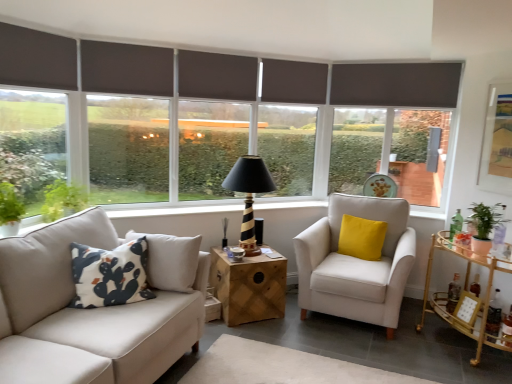
Question: Is dark gray roller blind at left, which is the 4th window from right to left, further to the viewer compared to dark gray roller blind at center, arranged as the second window when viewed from the right?

Choices:
 (A) yes
 (B) no

Answer: (B)

Question: Considering the relative positions of dark gray roller blind at left, which is the 4th window from right to left, and dark gray roller blind at center, arranged as the second window when viewed from the right, in the image provided, is dark gray roller blind at left, which is the 4th window from right to left, to the right of dark gray roller blind at center, arranged as the second window when viewed from the right, from the viewer's perspective?

Choices:
 (A) yes
 (B) no

Answer: (B)

Question: Is dark gray roller blind at center, arranged as the second window when viewed from the right, surrounded by dark gray roller blind at left, the first window positioned from the left?

Choices:
 (A) yes
 (B) no

Answer: (B)

Question: From a real-world perspective, is dark gray roller blind at left, the first window positioned from the left, over dark gray roller blind at center, arranged as the second window when viewed from the right?

Choices:
 (A) no
 (B) yes

Answer: (B)

Question: Considering the relative positions of dark gray roller blind at left, the first window positioned from the left, and dark gray roller blind at center, arranged as the second window when viewed from the right, in the image provided, is dark gray roller blind at left, the first window positioned from the left, to the left of dark gray roller blind at center, arranged as the second window when viewed from the right, from the viewer's perspective?

Choices:
 (A) yes
 (B) no

Answer: (A)

Question: From the image's perspective, is wooden cube at center, marked as the 2th table in a right-to-left arrangement, above or below dark gray roller blind at left, the first window positioned from the left?

Choices:
 (A) below
 (B) above

Answer: (A)

Question: Considering the positions of wooden cube at center, which appears as the first table when viewed from the left, and dark gray roller blind at left, the first window positioned from the left, in the image, is wooden cube at center, which appears as the first table when viewed from the left, taller or shorter than dark gray roller blind at left, the first window positioned from the left,?

Choices:
 (A) short
 (B) tall

Answer: (A)

Question: Is wooden cube at center, marked as the 2th table in a right-to-left arrangement, wider or thinner than dark gray roller blind at left, the first window positioned from the left?

Choices:
 (A) wide
 (B) thin

Answer: (A)

Question: Considering the positions of point (212, 248) and point (41, 173), is point (212, 248) closer or farther from the camera than point (41, 173)?

Choices:
 (A) farther
 (B) closer

Answer: (A)

Question: Is matte gold-framed artwork at upper right inside or outside of wooden cube at center, marked as the 2th table in a right-to-left arrangement?

Choices:
 (A) inside
 (B) outside

Answer: (B)

Question: Looking at the image, does matte gold-framed artwork at upper right seem bigger or smaller compared to wooden cube at center, marked as the 2th table in a right-to-left arrangement?

Choices:
 (A) big
 (B) small

Answer: (B)

Question: Relative to wooden cube at center, marked as the 2th table in a right-to-left arrangement, is matte gold-framed artwork at upper right in front or behind?

Choices:
 (A) behind
 (B) front

Answer: (B)

Question: From the image's perspective, relative to wooden cube at center, marked as the 2th table in a right-to-left arrangement, is matte gold-framed artwork at upper right above or below?

Choices:
 (A) below
 (B) above

Answer: (B)

Question: In terms of width, does matte gray roller blind at center, acting as the first window starting from the right, look wider or thinner when compared to dark gray roller blind at center, arranged as the second window when viewed from the right?

Choices:
 (A) wide
 (B) thin

Answer: (B)

Question: Is matte gray roller blind at center, acting as the first window starting from the right, inside or outside of dark gray roller blind at center, arranged as the second window when viewed from the right?

Choices:
 (A) inside
 (B) outside

Answer: (B)